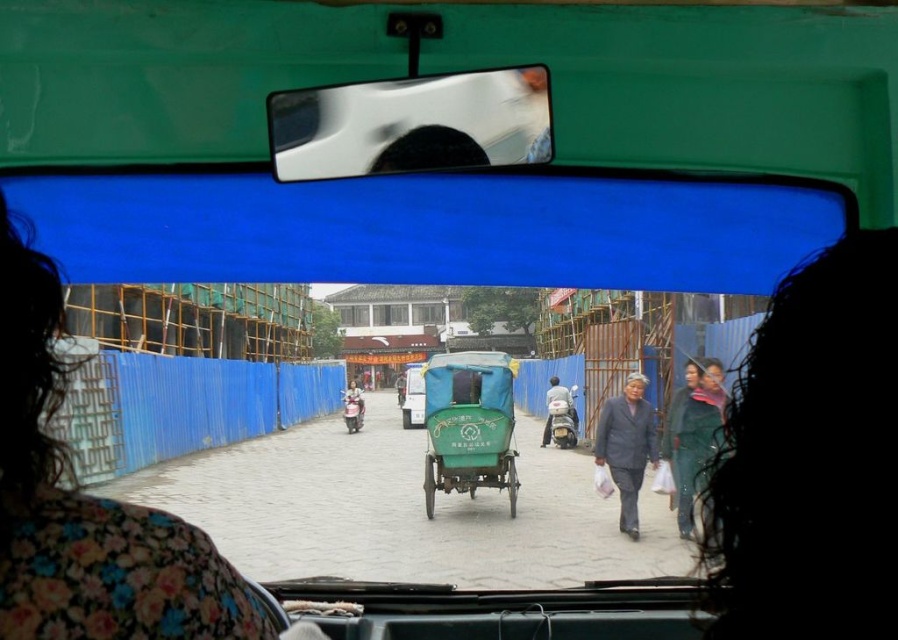
Question: Based on their relative distances, which object is farther from the green matte cart at center?

Choices:
 (A) light gray fabric scooter at center
 (B) gray fabric coat at center
 (C) shiny plastic mirror at upper center

Answer: (C)

Question: Does shiny plastic mirror at upper center have a smaller size compared to green matte tricycle at center?

Choices:
 (A) no
 (B) yes

Answer: (B)

Question: Which of the following is the closest to the observer?

Choices:
 (A) (418, 426)
 (B) (624, 403)
 (C) (23, 246)

Answer: (C)

Question: Is shiny plastic mirror at upper center bigger than green matte cart at center?

Choices:
 (A) yes
 (B) no

Answer: (B)

Question: Which object is the closest to the gray fabric coat at center?

Choices:
 (A) light gray fabric scooter at center
 (B) floral fabric headscarf at left
 (C) shiny plastic mirror at upper center
 (D) green matte cart at center

Answer: (D)

Question: Can you confirm if floral fabric headscarf at left is positioned below gray fabric coat at center?

Choices:
 (A) yes
 (B) no

Answer: (B)